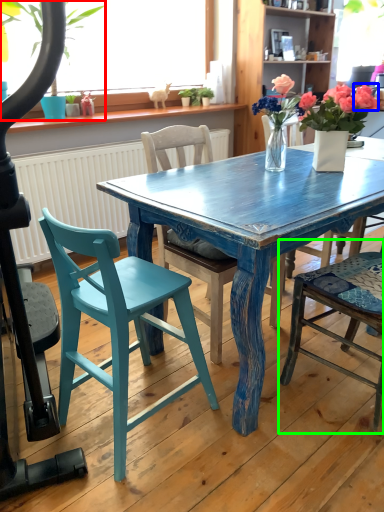
Question: Which object is the closest to the houseplant (highlighted by a red box)? Choose among these: flower (highlighted by a blue box) or chair (highlighted by a green box).

Choices:
 (A) flower
 (B) chair

Answer: (A)